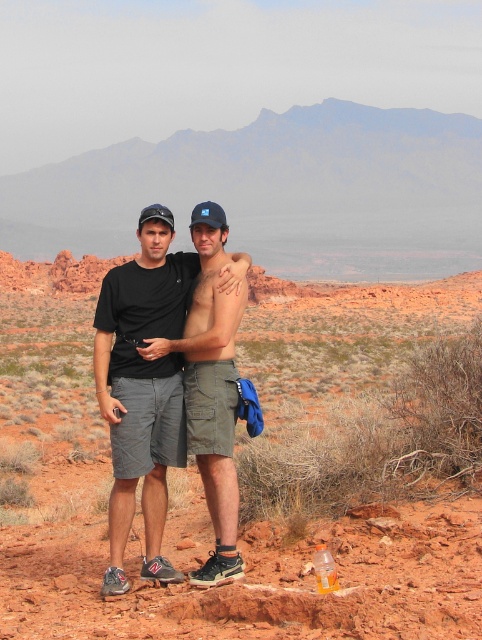
Question: Considering the real-world distances, which object is closest to the green cargo shorts at center?

Choices:
 (A) rustic sandstone rock at center
 (B) matte black t-shirt at center

Answer: (B)

Question: Which point is closer to the camera taking this photo?

Choices:
 (A) (227, 369)
 (B) (83, 307)
 (C) (132, 444)

Answer: (C)

Question: Is rustic sandstone rock at center to the left of matte black t-shirt at center from the viewer's perspective?

Choices:
 (A) no
 (B) yes

Answer: (A)

Question: Which object appears closest to the camera in this image?

Choices:
 (A) green cargo shorts at center
 (B) rustic sandstone rock at center
 (C) matte black t-shirt at center

Answer: (B)

Question: Does rustic sandstone rock at center have a smaller size compared to green cargo shorts at center?

Choices:
 (A) yes
 (B) no

Answer: (B)

Question: Observing the image, what is the correct spatial positioning of rustic sandstone rock at center in reference to green cargo shorts at center?

Choices:
 (A) above
 (B) below

Answer: (A)